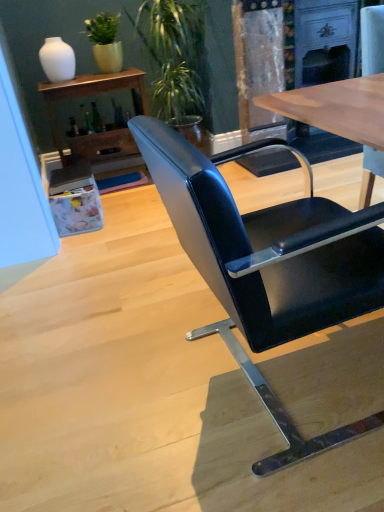
Question: In which direction should I rotate to look at green leafy plant at upper center, arranged as the second houseplant when viewed from the left?

Choices:
 (A) right
 (B) left

Answer: (B)

Question: From a real-world perspective, is black leather chair at center beneath green matte plant at upper left, the first houseplant positioned from the left?

Choices:
 (A) yes
 (B) no

Answer: (A)

Question: From the image's perspective, would you say black leather chair at center is shown under green matte plant at upper left, the first houseplant positioned from the left?

Choices:
 (A) yes
 (B) no

Answer: (A)

Question: Is black leather chair at center shorter than green matte plant at upper left, the first houseplant positioned from the left?

Choices:
 (A) no
 (B) yes

Answer: (A)

Question: Is black leather chair at center positioned beyond the bounds of green matte plant at upper left, placed as the second houseplant when sorted from right to left?

Choices:
 (A) no
 (B) yes

Answer: (B)

Question: Could green matte plant at upper left, placed as the second houseplant when sorted from right to left, be considered to be inside black leather chair at center?

Choices:
 (A) no
 (B) yes

Answer: (A)

Question: Can you confirm if black leather chair at center is taller than green matte plant at upper left, the first houseplant positioned from the left?

Choices:
 (A) no
 (B) yes

Answer: (B)

Question: From a real-world perspective, does white glossy vase at upper left stand above green leafy plant at upper center, the first houseplant positioned from the right?

Choices:
 (A) yes
 (B) no

Answer: (A)

Question: Is there a large distance between white glossy vase at upper left and green leafy plant at upper center, arranged as the second houseplant when viewed from the left?

Choices:
 (A) no
 (B) yes

Answer: (A)

Question: Is white glossy vase at upper left further to the viewer compared to green leafy plant at upper center, arranged as the second houseplant when viewed from the left?

Choices:
 (A) no
 (B) yes

Answer: (B)

Question: Is white glossy vase at upper left oriented away from green leafy plant at upper center, the first houseplant positioned from the right?

Choices:
 (A) no
 (B) yes

Answer: (A)

Question: Can you confirm if white glossy vase at upper left is smaller than green leafy plant at upper center, the first houseplant positioned from the right?

Choices:
 (A) yes
 (B) no

Answer: (A)

Question: Considering the relative sizes of white glossy vase at upper left and green leafy plant at upper center, the first houseplant positioned from the right, in the image provided, is white glossy vase at upper left taller than green leafy plant at upper center, the first houseplant positioned from the right,?

Choices:
 (A) yes
 (B) no

Answer: (B)

Question: From a real-world perspective, does matte wood shelf at upper left sit lower than white glossy vase at upper left?

Choices:
 (A) yes
 (B) no

Answer: (A)